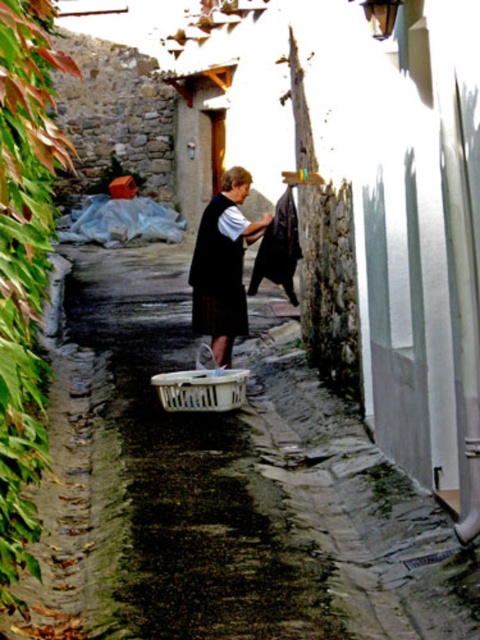
Question: Is matte black vest at center wider than white plastic basket at center?

Choices:
 (A) yes
 (B) no

Answer: (B)

Question: Is matte black vest at center below white plastic basket at center?

Choices:
 (A) yes
 (B) no

Answer: (B)

Question: Which of the following is the farthest from the observer?

Choices:
 (A) white plastic basket at center
 (B) matte black vest at center

Answer: (B)

Question: Which object is positioned farthest from the matte black vest at center?

Choices:
 (A) dark blue fabric dress at center
 (B) white plastic basket at center

Answer: (B)

Question: Does dark blue fabric dress at center appear under white plastic basket at center?

Choices:
 (A) no
 (B) yes

Answer: (A)

Question: Which object appears closest to the camera in this image?

Choices:
 (A) matte black vest at center
 (B) dark blue fabric dress at center

Answer: (B)